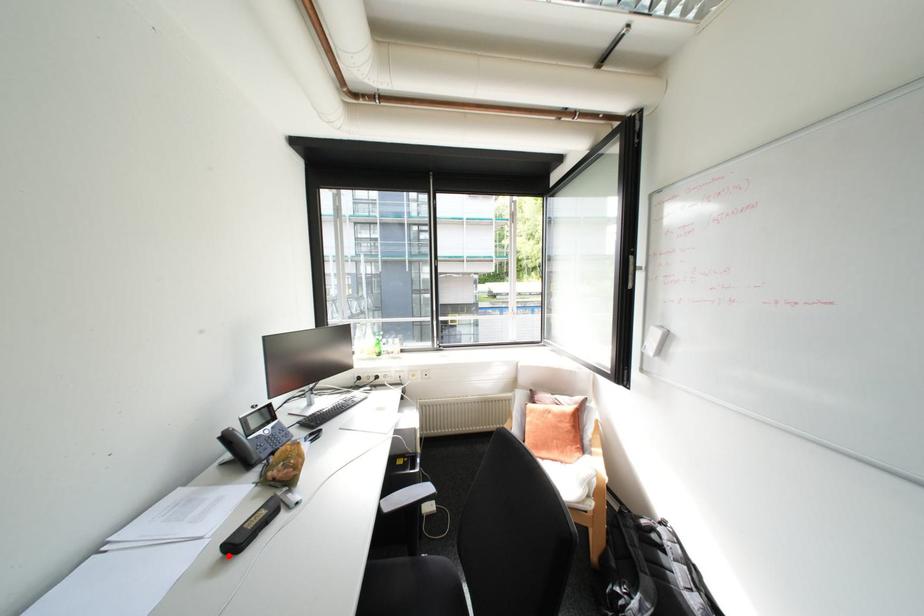
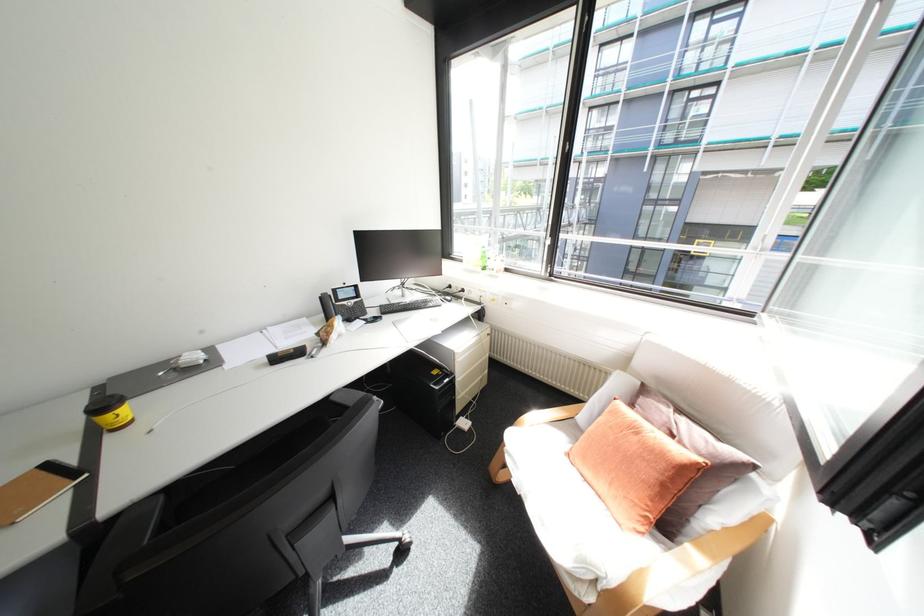
Find the pixel in the second image that matches the highlighted location in the first image.

(275, 361)